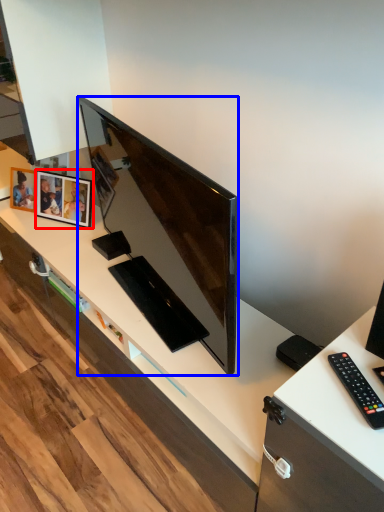
Question: Which object appears closest to the camera in this image, picture frame (highlighted by a red box) or television (highlighted by a blue box)?

Choices:
 (A) picture frame
 (B) television

Answer: (B)